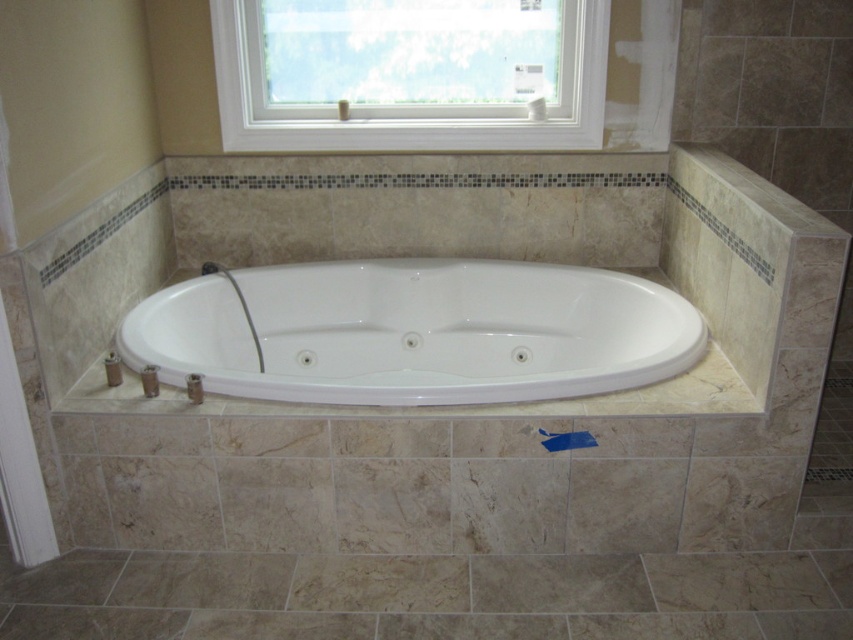
Is white glossy bathtub at center positioned in front of matte white shower at lower left?

Yes.

Between white glossy bathtub at center and matte white shower at lower left, which one is positioned higher?

matte white shower at lower left

Is point (299, 282) farther from camera compared to point (219, 269)?

Yes, it is behind point (219, 269).

Identify the location of white glossy bathtub at center. (415, 332).

Can you confirm if white plastic window at upper center is positioned to the right of beige marble tile at lower center?

No, white plastic window at upper center is not to the right of beige marble tile at lower center.

Is white plastic window at upper center taller than beige marble tile at lower center?

Yes.

Identify the location of white plastic window at upper center. The image size is (853, 640). (407, 74).

The image size is (853, 640). Find the location of `white plastic window at upper center`. white plastic window at upper center is located at coordinates point(407,74).

Is point (389, 381) positioned in front of point (498, 557)?

No, (389, 381) is further to viewer.

Does white glossy bathtub at center lie in front of beige marble tile at lower center?

That is False.

Is point (206, 356) positioned behind point (473, 572)?

That is True.

Identify the location of white glossy bathtub at center. (415, 332).